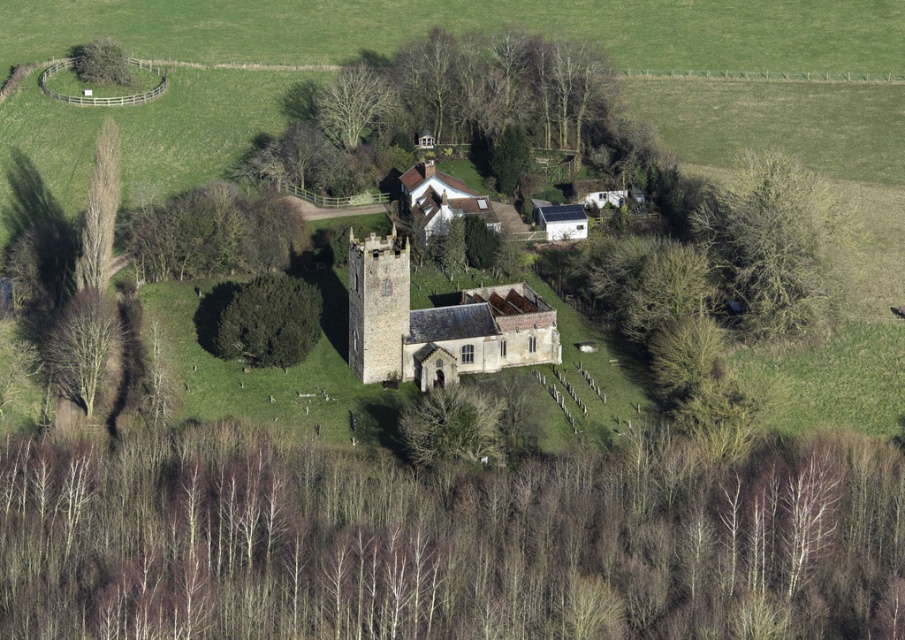
Find the location of a particular element. green leafy bush at right is located at coordinates (770, 244).

Which of these two, green leafy bush at right or green leafy tree at upper left, stands taller?

Standing taller between the two is green leafy bush at right.

Between point (739, 280) and point (89, 65), which one is positioned behind?

Point (89, 65)

You are a GUI agent. You are given a task and a screenshot of the screen. Output one action in this format:
    pyautogui.click(x=<x>, y=<y>)
    Task: Click on the green leafy bush at right
    The image size is (905, 640).
    Given the screenshot: What is the action you would take?
    pyautogui.click(x=770, y=244)

Is stone church at center below green leafy bush at left?

Correct, stone church at center is located below green leafy bush at left.

From the picture: Is stone church at center to the right of green leafy bush at left from the viewer's perspective?

Indeed, stone church at center is positioned on the right side of green leafy bush at left.

Does point (446, 355) come in front of point (141, 253)?

Yes, point (446, 355) is in front of point (141, 253).

Image resolution: width=905 pixels, height=640 pixels. What are the coordinates of `stone church at center` in the screenshot? It's located at (436, 323).

Does point (303, 483) come in front of point (336, 128)?

That is True.

Who is lower down, bare wood trees at bottom or bare branches at upper center?

Positioned lower is bare wood trees at bottom.

What do you see at coordinates (446, 541) in the screenshot? I see `bare wood trees at bottom` at bounding box center [446, 541].

Locate an element on the screen. bare wood trees at bottom is located at coordinates (446, 541).